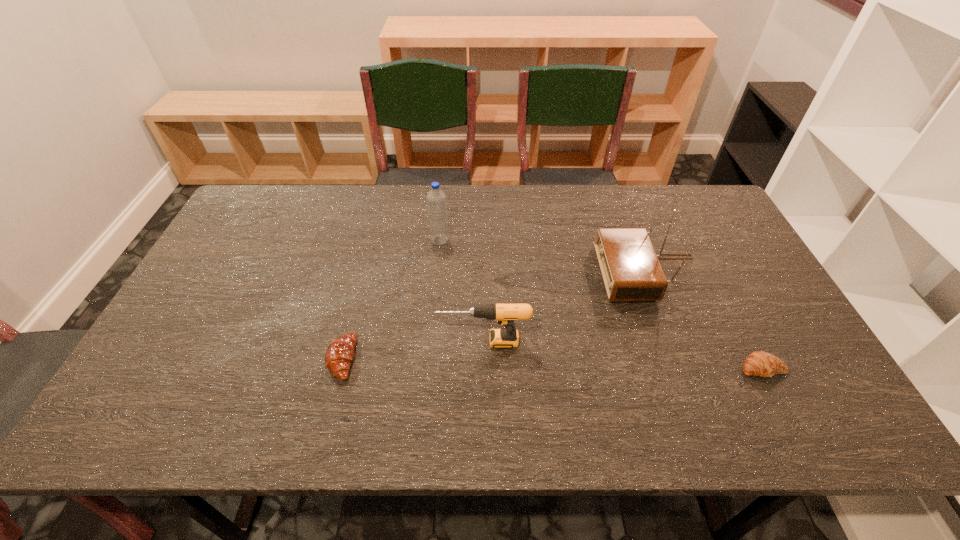
Where is `free space located on the handle side of the drill`? free space located on the handle side of the drill is located at coordinates (363, 341).

You are a GUI agent. You are given a task and a screenshot of the screen. Output one action in this format:
    pyautogui.click(x=<x>, y=<y>)
    Task: Click on the vacant space situated 0.290m on the handle side of the drill
    This screenshot has height=540, width=960.
    Given the screenshot: What is the action you would take?
    click(323, 341)

Locate an element on the screen. The width and height of the screenshot is (960, 540). free point located on the back of the left crescent roll is located at coordinates (372, 239).

Locate an element on the screen. vacant space located 0.370m on the back of the right crescent roll is located at coordinates (704, 254).

Find the location of `object that is positioned at the right edge`. object that is positioned at the right edge is located at coordinates (759, 363).

You are a GUI agent. You are given a task and a screenshot of the screen. Output one action in this format:
    pyautogui.click(x=<x>, y=<y>)
    Task: Click on the vacant space at the far edge of the desktop
    The width and height of the screenshot is (960, 540).
    Given the screenshot: What is the action you would take?
    pyautogui.click(x=490, y=191)

Where is `free space at the near edge`? This screenshot has height=540, width=960. free space at the near edge is located at coordinates (587, 435).

In order to click on free spot at the left edge of the desktop in this screenshot , I will do `click(128, 394)`.

This screenshot has width=960, height=540. Identify the location of vacant space at the right edge of the desktop. (800, 360).

At what (x,y) coordinates should I click in order to perform the action: click on free space at the far right corner of the desktop. Please return your answer as a coordinate pair (x, y). This screenshot has width=960, height=540. Looking at the image, I should click on (703, 187).